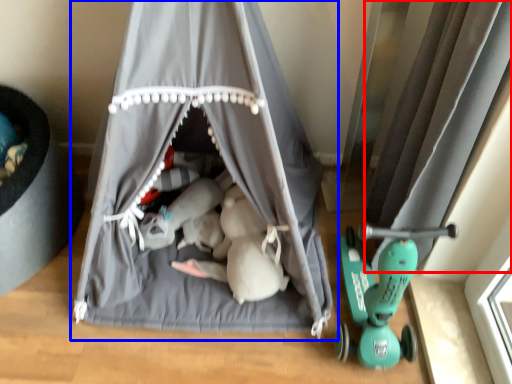
Question: Which point is closer to the camera, curtain (highlighted by a red box) or curtain (highlighted by a blue box)?

Choices:
 (A) curtain
 (B) curtain

Answer: (B)